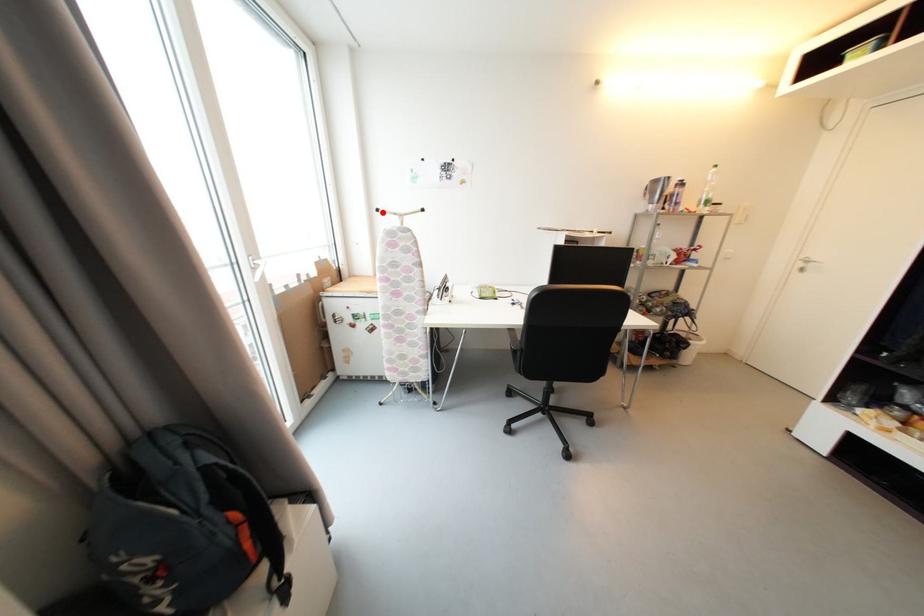
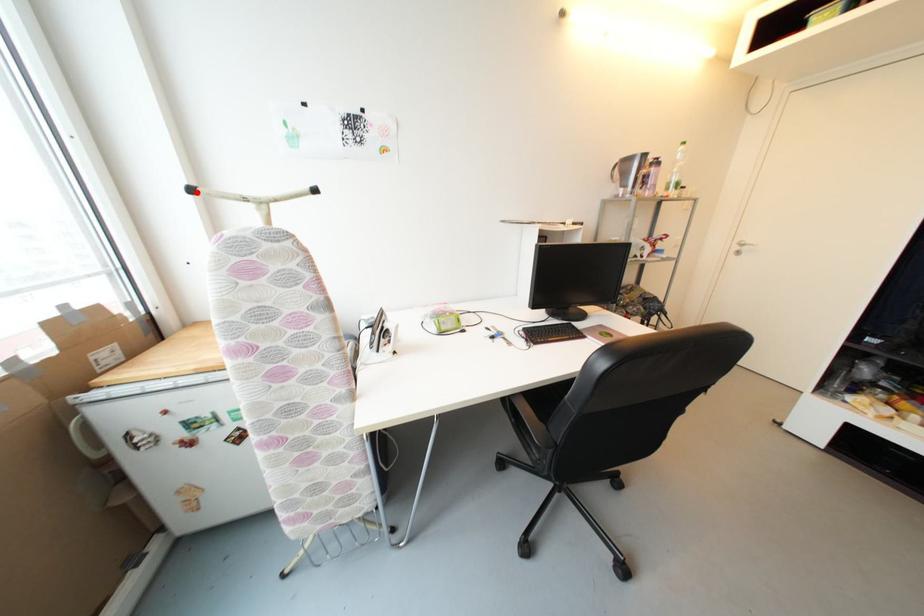
I am providing you with two images of the same scene from different viewpoints. A red point is marked on the first image and another point is marked on the second image. Is the marked point in image1 the same physical position as the marked point in image2?

Yes